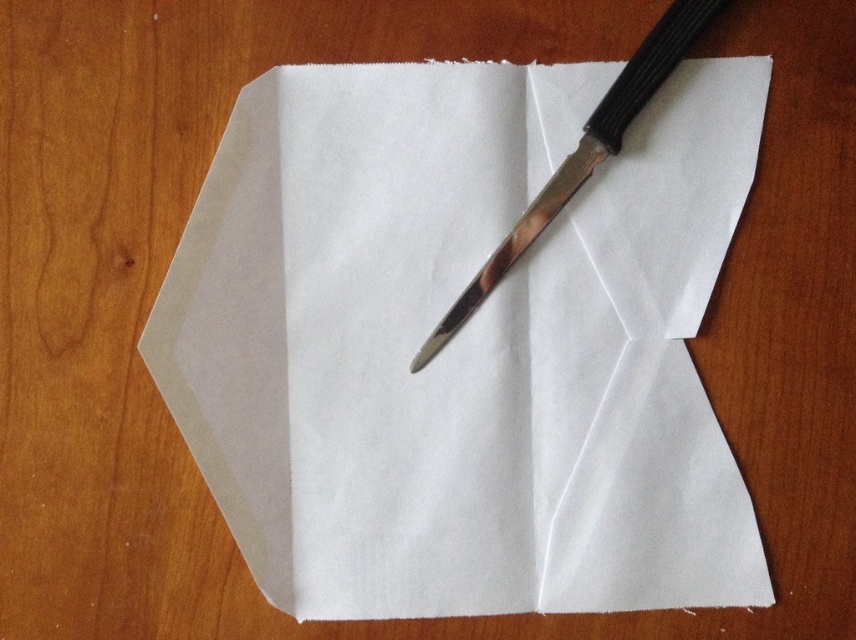
Who is more distant from viewer, (452, 346) or (437, 330)?

The point (452, 346) is behind.

Consider the image. Is white matte paper at center wider than polished metal knife at center?

Indeed, white matte paper at center has a greater width compared to polished metal knife at center.

Image resolution: width=856 pixels, height=640 pixels. In order to click on white matte paper at center in this screenshot , I will do `click(462, 342)`.